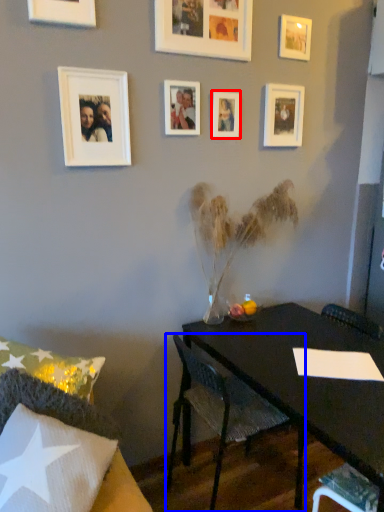
Question: Among these objects, which one is farthest to the camera, picture frame (highlighted by a red box) or chair (highlighted by a blue box)?

Choices:
 (A) picture frame
 (B) chair

Answer: (A)